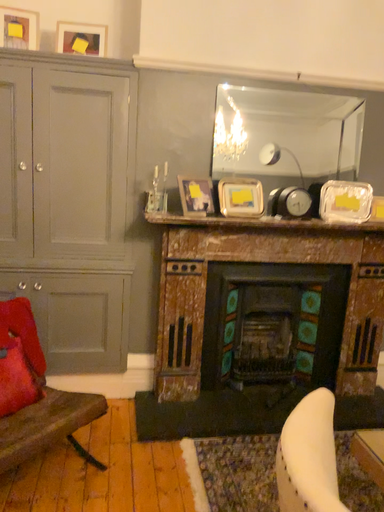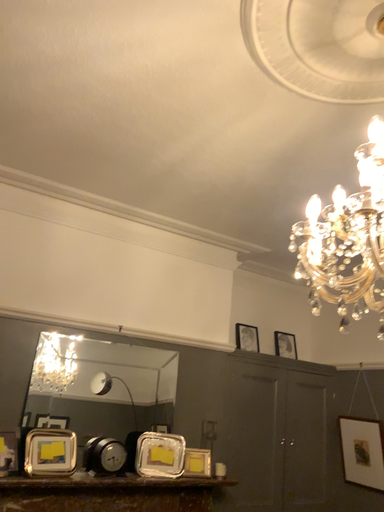
Question: How did the camera likely rotate when shooting the video?

Choices:
 (A) rotated left
 (B) rotated right

Answer: (B)